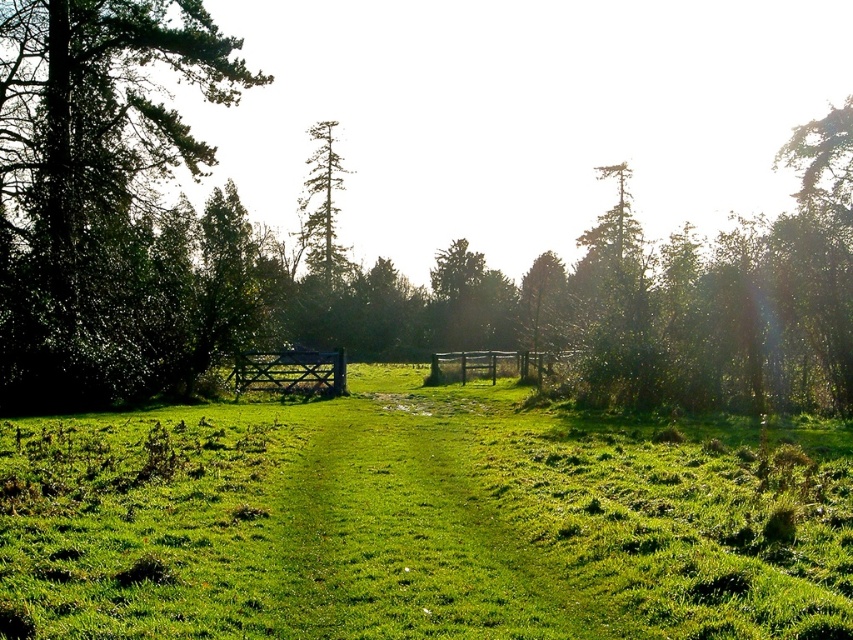
Between green leafy tree at left and wooden fence at center, which one appears on the left side from the viewer's perspective?

green leafy tree at left

Does green leafy tree at left have a lesser height compared to wooden fence at center?

No.

You are a GUI agent. You are given a task and a screenshot of the screen. Output one action in this format:
    pyautogui.click(x=<x>, y=<y>)
    Task: Click on the green leafy tree at left
    The width and height of the screenshot is (853, 640).
    Given the screenshot: What is the action you would take?
    pyautogui.click(x=97, y=193)

Identify the location of green leafy tree at left. (97, 193).

Based on the photo, measure the distance between wooden gate at center and wooden fence at center.

wooden gate at center is 7.14 meters from wooden fence at center.

Does wooden gate at center have a lesser width compared to wooden fence at center?

Yes, wooden gate at center is thinner than wooden fence at center.

Is point (242, 378) farther from viewer compared to point (438, 378)?

No, it is in front of (438, 378).

Locate an element on the screen. This screenshot has width=853, height=640. wooden gate at center is located at coordinates (289, 371).

Is point (105, 620) positioned in front of point (506, 364)?

Yes, point (105, 620) is closer to viewer.

Which of these two, green grassy pasture at center or wooden fence at center, stands taller?

wooden fence at center is taller.

Who is more distant from viewer, [117,605] or [497,355]?

The point [497,355] is behind.

Identify the location of green grassy pasture at center. (418, 520).